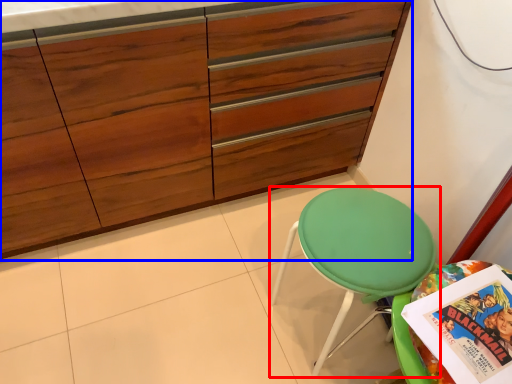
Question: Among these objects, which one is farthest to the camera, chair (highlighted by a red box) or cabinetry (highlighted by a blue box)?

Choices:
 (A) chair
 (B) cabinetry

Answer: (A)